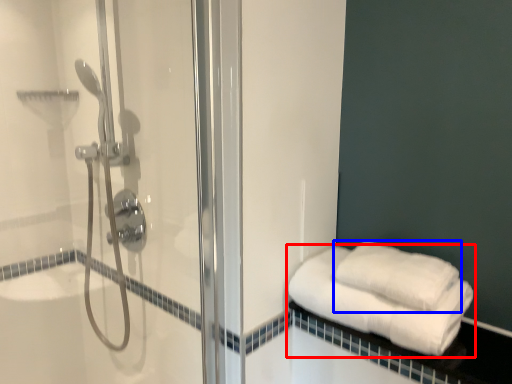
Question: Which of the following is the closest to the observer, towel (highlighted by a red box) or towel (highlighted by a blue box)?

Choices:
 (A) towel
 (B) towel

Answer: (A)